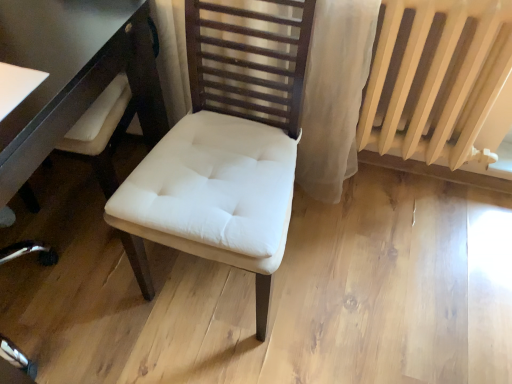
Identify the location of vacant area situated below beige painted radiator at right (from a real-world perspective). (414, 190).